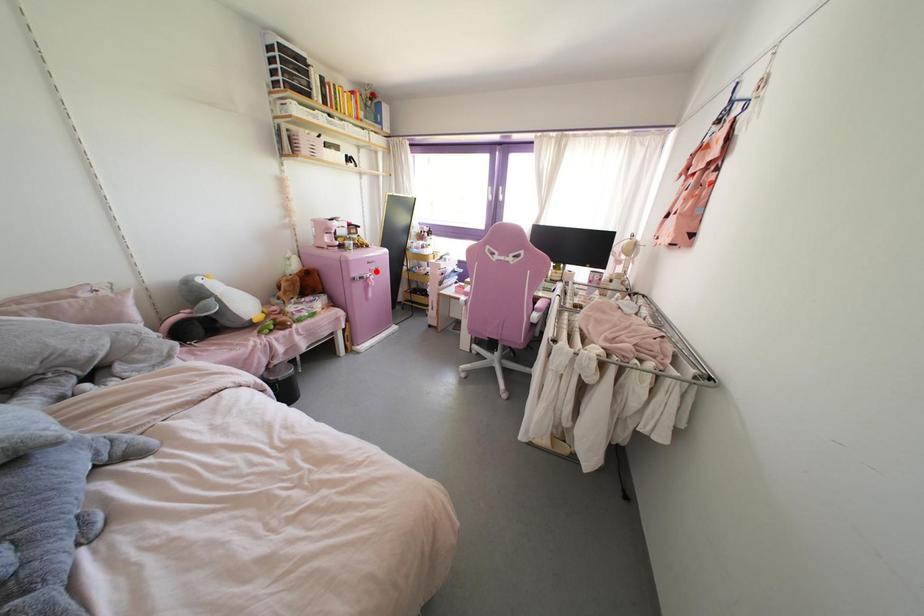
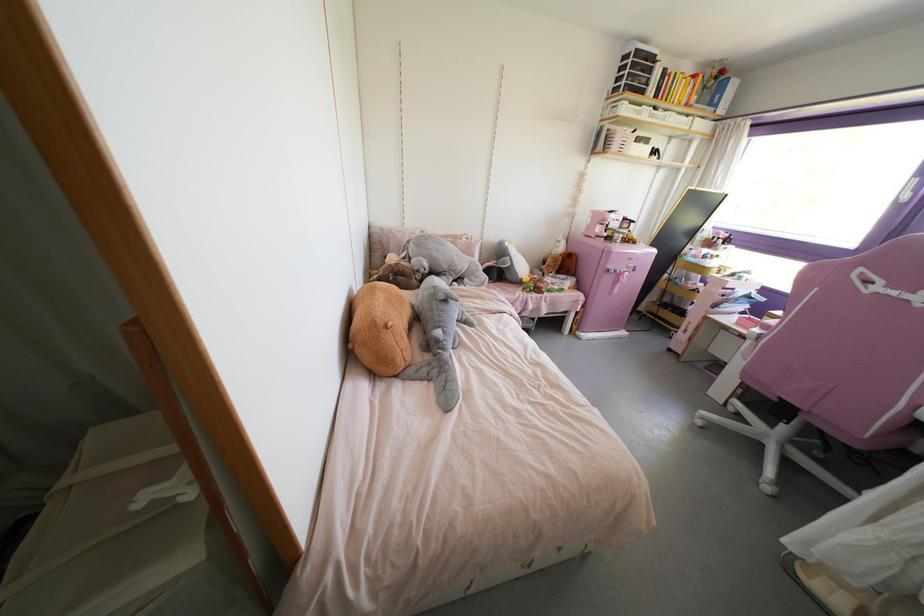
The point at the highlighted location is marked in the first image. Where is the corresponding point in the second image?

(633, 270)